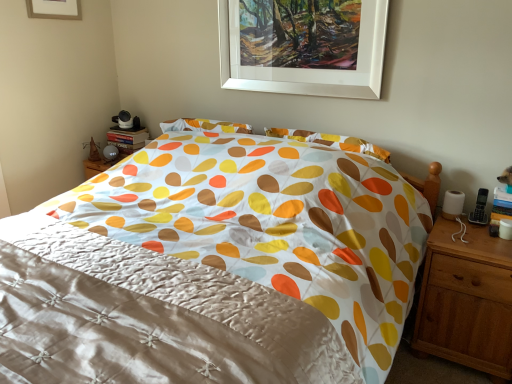
Question: Is silky white quilt at center turned away from white matte picture frame at upper center, marked as the second picture frame in a bottom-to-top arrangement?

Choices:
 (A) no
 (B) yes

Answer: (A)

Question: From a real-world perspective, is silky white quilt at center below white matte picture frame at upper center, placed as the 1th picture frame when sorted from left to right?

Choices:
 (A) no
 (B) yes

Answer: (B)

Question: Is white matte picture frame at upper center, the 2th picture frame viewed from the right, surrounded by silky white quilt at center?

Choices:
 (A) no
 (B) yes

Answer: (A)

Question: From the image's perspective, is silky white quilt at center located beneath white matte picture frame at upper center, placed as the 1th picture frame when sorted from left to right?

Choices:
 (A) no
 (B) yes

Answer: (B)

Question: Is silky white quilt at center aimed at white matte picture frame at upper center, the 2th picture frame viewed from the right?

Choices:
 (A) yes
 (B) no

Answer: (B)

Question: From the image's perspective, relative to light brown wood nightstand at right, is white matte picture frame at upper center, the 2th picture frame viewed from the right, above or below?

Choices:
 (A) above
 (B) below

Answer: (A)

Question: Choose the correct answer: Is white matte picture frame at upper center, marked as the second picture frame in a bottom-to-top arrangement, inside light brown wood nightstand at right or outside it?

Choices:
 (A) outside
 (B) inside

Answer: (A)

Question: Considering the relative positions of white matte picture frame at upper center, marked as the second picture frame in a bottom-to-top arrangement, and light brown wood nightstand at right in the image provided, is white matte picture frame at upper center, marked as the second picture frame in a bottom-to-top arrangement, to the left or to the right of light brown wood nightstand at right?

Choices:
 (A) right
 (B) left

Answer: (B)

Question: Considering their positions, is white matte picture frame at upper center, placed as the 1th picture frame when sorted from left to right, located in front of or behind light brown wood nightstand at right?

Choices:
 (A) front
 (B) behind

Answer: (B)

Question: Is white matte picture frame at upper center, the 1th picture frame viewed from the right, bigger or smaller than light brown wood nightstand at right?

Choices:
 (A) small
 (B) big

Answer: (A)

Question: From the image's perspective, is white matte picture frame at upper center, the 1th picture frame viewed from the right, located above or below light brown wood nightstand at right?

Choices:
 (A) below
 (B) above

Answer: (B)

Question: Which is correct: white matte picture frame at upper center, the 2th picture frame from the left, is inside light brown wood nightstand at right, or outside of it?

Choices:
 (A) outside
 (B) inside

Answer: (A)

Question: In the image, is white matte picture frame at upper center, which is the second picture frame from top to bottom, positioned in front of or behind light brown wood nightstand at right?

Choices:
 (A) front
 (B) behind

Answer: (B)

Question: From the image's perspective, is silky white quilt at center above or below white matte picture frame at upper center, the 2th picture frame from the left?

Choices:
 (A) above
 (B) below

Answer: (B)

Question: Considering the positions of point (113, 249) and point (245, 64), is point (113, 249) closer or farther from the camera than point (245, 64)?

Choices:
 (A) closer
 (B) farther

Answer: (A)